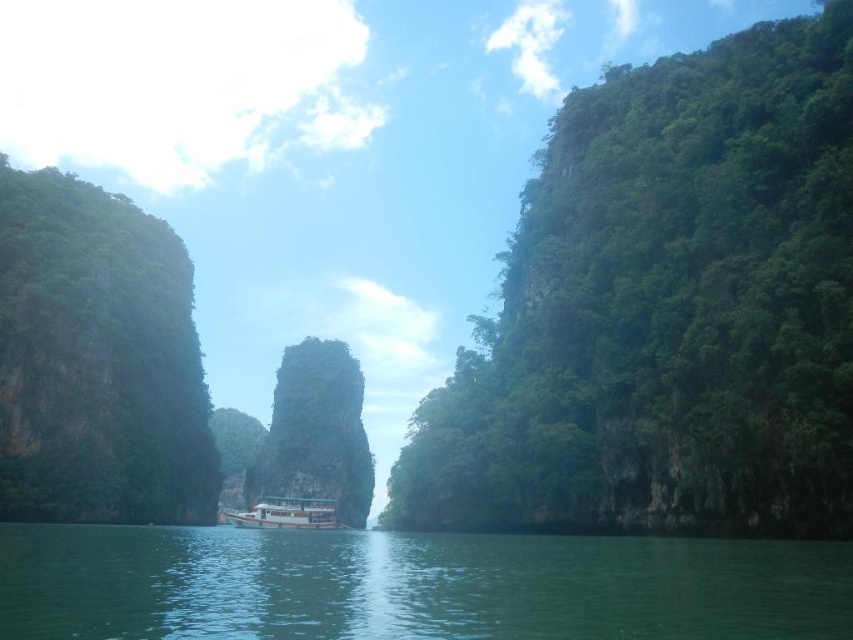
Does rusty stone rock at center have a greater width compared to white matte boat at center?

Yes, rusty stone rock at center is wider than white matte boat at center.

Does rusty stone rock at center have a larger size compared to white matte boat at center?

Yes, rusty stone rock at center is bigger than white matte boat at center.

Which is in front, point (263, 444) or point (250, 509)?

Point (250, 509)

Locate an element on the screen. This screenshot has width=853, height=640. rusty stone rock at center is located at coordinates (316, 433).

Which is behind, point (138, 566) or point (363, 504)?

The point (363, 504) is behind.

What do you see at coordinates (412, 586) in the screenshot?
I see `green smooth water at center` at bounding box center [412, 586].

Find the location of `green smooth water at center`. green smooth water at center is located at coordinates (412, 586).

Identify the location of green smooth water at center. (412, 586).

Does green smooth water at center have a lesser height compared to white matte boat at center?

No, green smooth water at center is not shorter than white matte boat at center.

Between green smooth water at center and white matte boat at center, which one is positioned higher?

green smooth water at center is higher up.

Find the location of a particular element. The height and width of the screenshot is (640, 853). green smooth water at center is located at coordinates (412, 586).